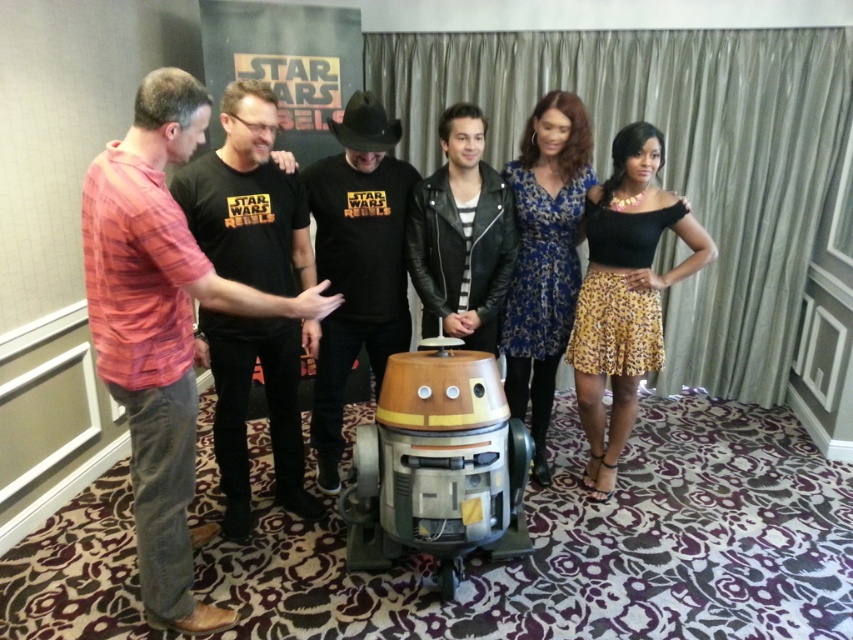
Question: Which point is closer to the camera taking this photo?

Choices:
 (A) (688, 236)
 (B) (482, 115)

Answer: (B)

Question: Does black leopard print skirt at right appear under leather jacket at center?

Choices:
 (A) no
 (B) yes

Answer: (B)

Question: Is red plaid shirt at left below black leopard print skirt at right?

Choices:
 (A) no
 (B) yes

Answer: (B)

Question: Among these objects, which one is farthest from the camera?

Choices:
 (A) leather jacket at center
 (B) red plaid shirt at left
 (C) blue floral dress at center

Answer: (C)

Question: Does black leopard print skirt at right appear on the left side of black leather shirt at center?

Choices:
 (A) no
 (B) yes

Answer: (A)

Question: Which of these objects is positioned farthest from the black leopard print skirt at right?

Choices:
 (A) black leather shirt at center
 (B) red plaid shirt at left
 (C) blue floral dress at center
 (D) leather jacket at center

Answer: (B)